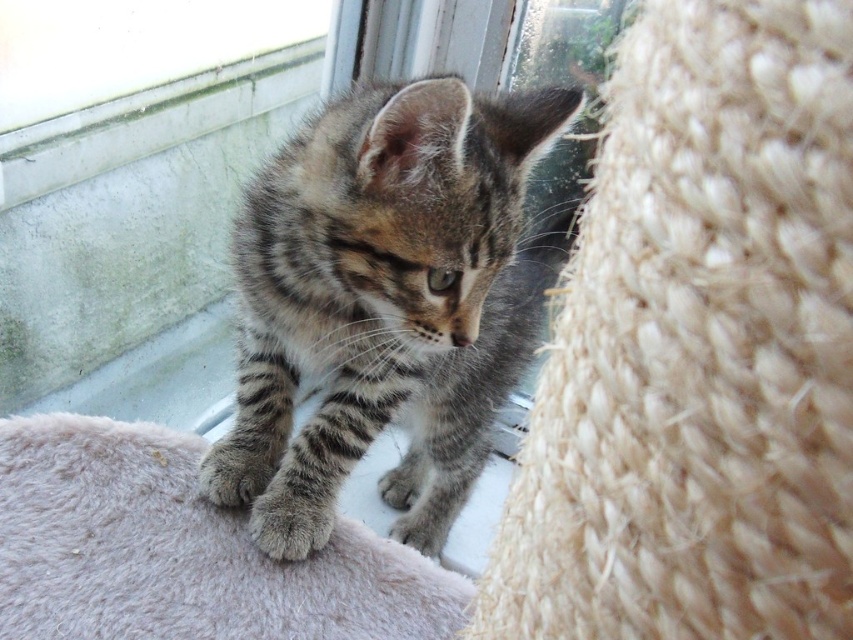
Question: Which of the following is the closest to the observer?

Choices:
 (A) soft fur paw at center
 (B) fuzzy gray blanket at lower left
 (C) soft gray fur paw at lower left

Answer: (B)

Question: Which object appears farthest from the camera in this image?

Choices:
 (A) fuzzy gray blanket at lower left
 (B) striped fur kitten at center
 (C) soft fur paw at center

Answer: (C)

Question: In this image, where is striped fur kitten at center located relative to fuzzy gray blanket at lower left?

Choices:
 (A) right
 (B) left

Answer: (A)

Question: Which is farther from the fuzzy gray blanket at lower left?

Choices:
 (A) soft fur paw at center
 (B) soft gray fur paw at lower left
 (C) striped fur kitten at center

Answer: (C)

Question: Is fuzzy gray blanket at lower left behind soft gray fur paw at lower left?

Choices:
 (A) no
 (B) yes

Answer: (A)

Question: Does striped fur kitten at center appear over fuzzy gray blanket at lower left?

Choices:
 (A) no
 (B) yes

Answer: (B)